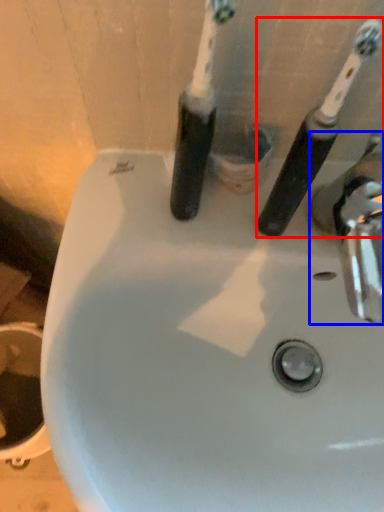
Question: Which of the following is the farthest to the observer, toothbrush (highlighted by a red box) or tap (highlighted by a blue box)?

Choices:
 (A) toothbrush
 (B) tap

Answer: (B)